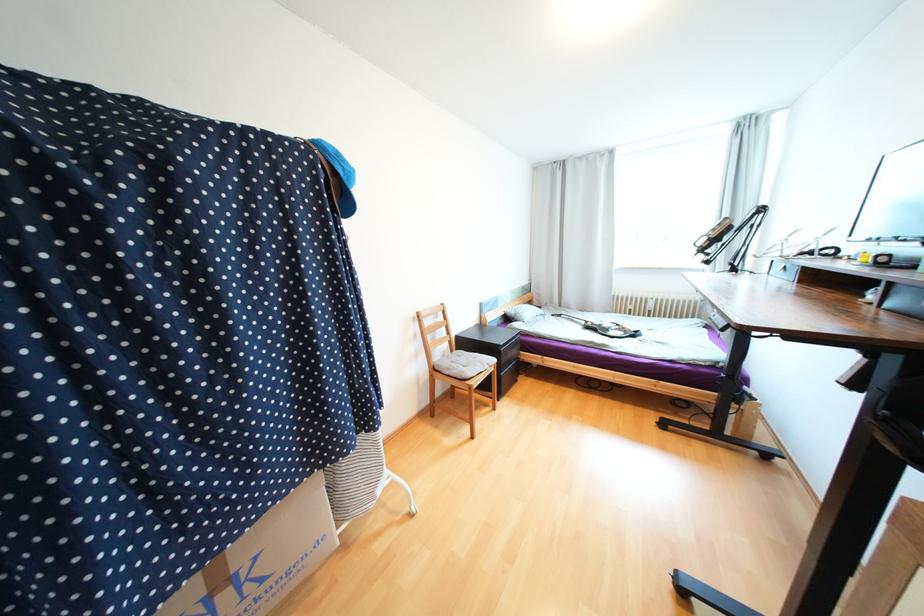
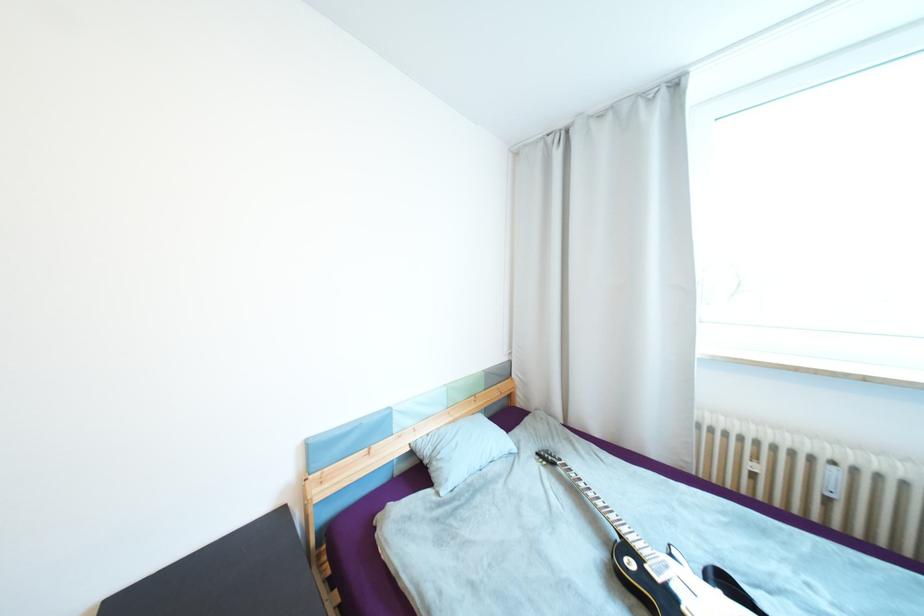
What movement of the cameraman would produce the second image?

The cameraman walked toward right, forward.